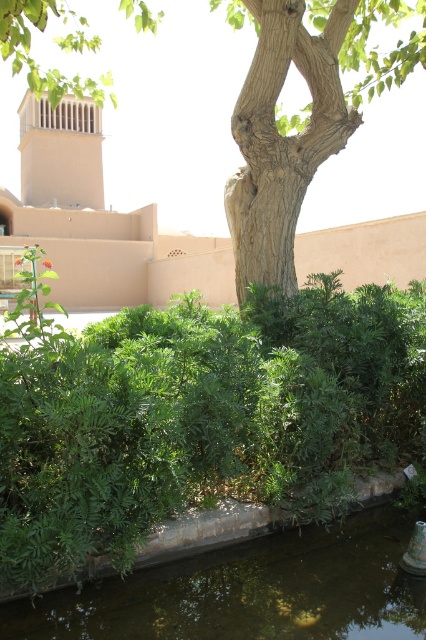
In the scene shown: Can you confirm if green leafy hedge at center is shorter than smooth brown tree trunk at center?

Indeed, green leafy hedge at center has a lesser height compared to smooth brown tree trunk at center.

Does green leafy hedge at center come behind smooth brown tree trunk at center?

No, green leafy hedge at center is in front of smooth brown tree trunk at center.

The width and height of the screenshot is (426, 640). What are the coordinates of `green leafy hedge at center` in the screenshot? It's located at (201, 417).

Between green leafy hedge at center and greenish concrete water at bottom, which one appears on the right side from the viewer's perspective?

From the viewer's perspective, greenish concrete water at bottom appears more on the right side.

Locate an element on the screen. green leafy hedge at center is located at coordinates (201, 417).

What do you see at coordinates (224, 189) in the screenshot? I see `smooth brown tree trunk at center` at bounding box center [224, 189].

What do you see at coordinates (224, 189) in the screenshot? I see `smooth brown tree trunk at center` at bounding box center [224, 189].

Find the location of a particular element. The width and height of the screenshot is (426, 640). smooth brown tree trunk at center is located at coordinates (224, 189).